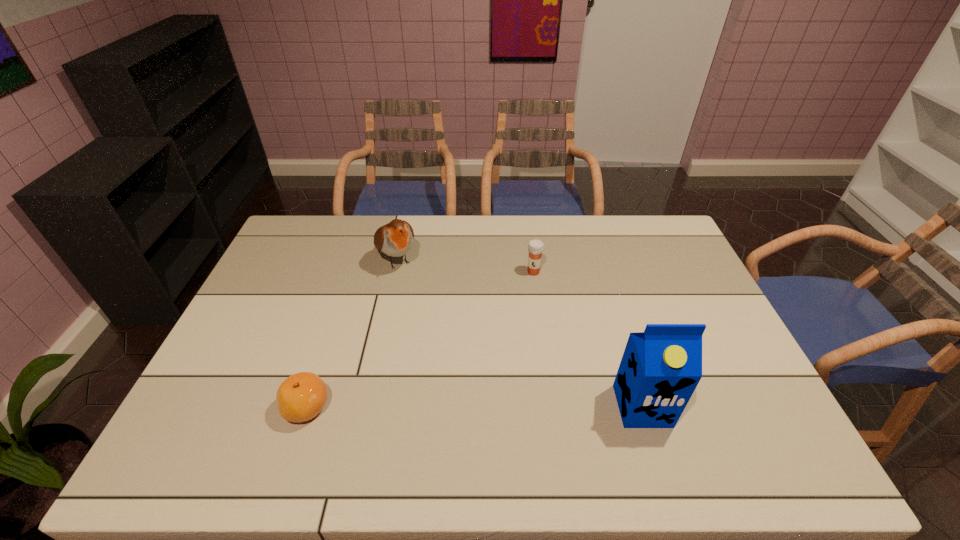
Locate an element on the screen. The image size is (960, 540). clementine is located at coordinates (300, 397).

This screenshot has width=960, height=540. What are the coordinates of `the leftmost object` in the screenshot? It's located at (300, 397).

Identify the location of the tallest object. (661, 367).

Where is `carton`? Image resolution: width=960 pixels, height=540 pixels. carton is located at coordinates (661, 367).

Where is `medicine`? This screenshot has height=540, width=960. medicine is located at coordinates (536, 247).

I want to click on the second shortest object, so click(536, 247).

Where is `bird`? Image resolution: width=960 pixels, height=540 pixels. bird is located at coordinates (395, 239).

Find the location of a particular element. The height and width of the screenshot is (540, 960). the second tallest object is located at coordinates (395, 239).

The height and width of the screenshot is (540, 960). In order to click on free space located on the back of the leftmost object in this screenshot , I will do `click(346, 287)`.

The height and width of the screenshot is (540, 960). What are the coordinates of `free region located 0.110m on the label side of the second object from right to left` in the screenshot? It's located at (522, 298).